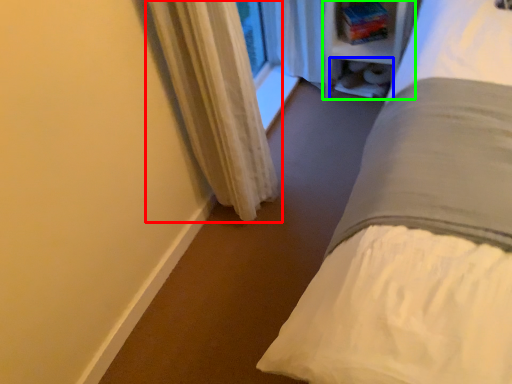
Question: Which is farther away from curtain (highlighted by a red box)? shelf (highlighted by a blue box) or bookshelf (highlighted by a green box)?

Choices:
 (A) shelf
 (B) bookshelf

Answer: (A)